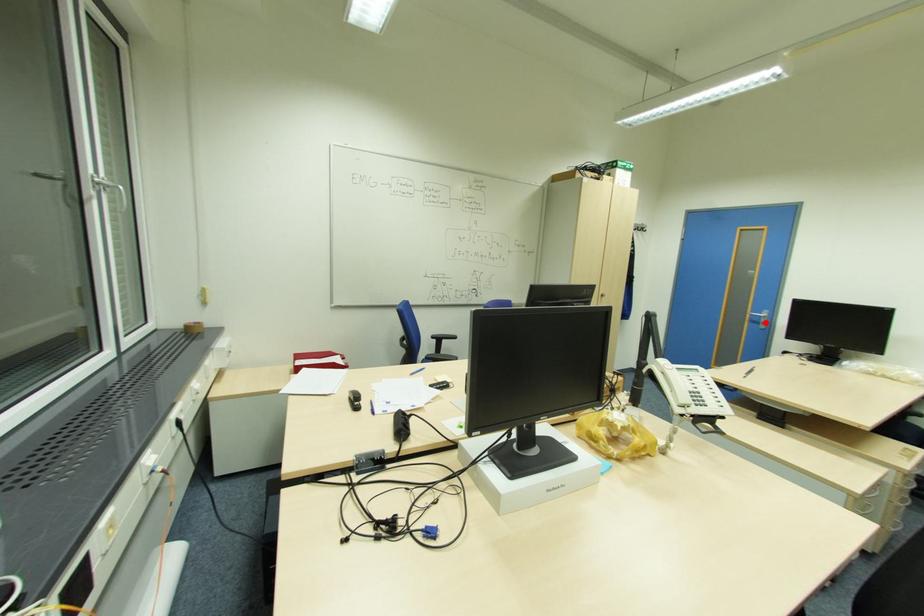
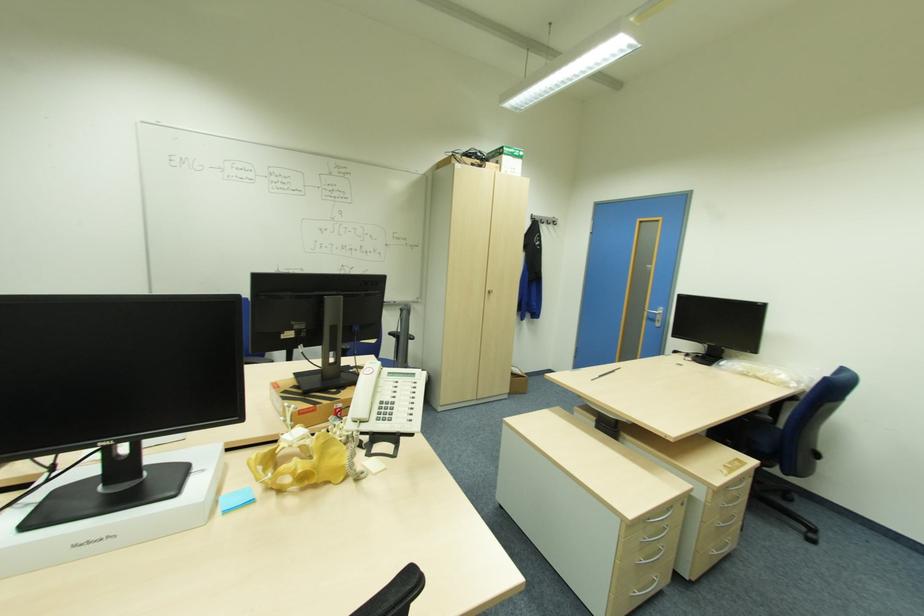
Where in the second image is the point corresponding to the highlighted location from the first image?

(661, 321)